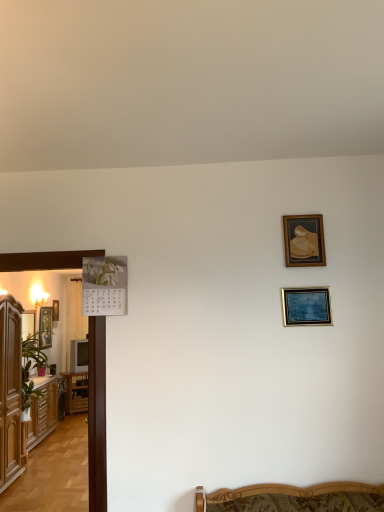
Identify the location of gold-framed picture at left, marked as the fifth picture frame in a right-to-left arrangement. This screenshot has width=384, height=512. (55, 310).

Where is `brown wooden table at left`? This screenshot has height=512, width=384. brown wooden table at left is located at coordinates (76, 392).

Where is `wooden cabinet at left, which is the second cabinetry in front-to-back order`? wooden cabinet at left, which is the second cabinetry in front-to-back order is located at coordinates (41, 413).

The height and width of the screenshot is (512, 384). What do you see at coordinates (28, 324) in the screenshot?
I see `matte wooden picture frame at left, which is the 3th picture frame in front-to-back order` at bounding box center [28, 324].

Identify the location of metallic silver picture frame at center right, the 2th picture frame positioned from the right. The height and width of the screenshot is (512, 384). (306, 306).

From the image's perspective, is wooden cabinet at left, which is the second cabinetry in front-to-back order, located beneath gold-framed picture at left, marked as the fifth picture frame in a right-to-left arrangement?

Yes.

From a real-world perspective, count 4th picture frames upward from the wooden cabinet at left, which is the second cabinetry in front-to-back order, and point to it. Please provide its 2D coordinates.

[(55, 310)]

From a real-world perspective, is wooden cabinet at left, which is the second cabinetry in front-to-back order, physically located above or below gold-framed picture at left, marked as the fifth picture frame in a right-to-left arrangement?

wooden cabinet at left, which is the second cabinetry in front-to-back order, is below gold-framed picture at left, marked as the fifth picture frame in a right-to-left arrangement.

Is gold-framed picture at upper right, which is the fourth picture frame in back-to-front order, at the back of gold-framed portrait at left, acting as the third picture frame starting from the left?

No, gold-framed picture at upper right, which is the fourth picture frame in back-to-front order, is not at the back of gold-framed portrait at left, acting as the third picture frame starting from the left.

Is point (40, 324) less distant than point (298, 232)?

No, (40, 324) is further to viewer.

Locate an element on the screen. The height and width of the screenshot is (512, 384). the 2nd picture frame in front of the gold-framed portrait at left, marked as the third picture frame in a right-to-left arrangement is located at coordinates (304, 240).

Can we say gold-framed portrait at left, acting as the third picture frame starting from the left, lies outside gold-framed picture at upper right, which is the fourth picture frame in back-to-front order?

gold-framed portrait at left, acting as the third picture frame starting from the left, is positioned outside gold-framed picture at upper right, which is the fourth picture frame in back-to-front order.

From the image's perspective, which cabinetry is the 2nd one below the gold-framed picture at upper right, the second picture frame when ordered from front to back? Please provide its 2D coordinates.

[(41, 413)]

Considering the relative positions of gold-framed picture at upper right, which is the first picture frame from right to left, and wooden cabinet at left, which is the second cabinetry in front-to-back order, in the image provided, is gold-framed picture at upper right, which is the first picture frame from right to left, to the right of wooden cabinet at left, which is the second cabinetry in front-to-back order, from the viewer's perspective?

Correct, you'll find gold-framed picture at upper right, which is the first picture frame from right to left, to the right of wooden cabinet at left, which is the second cabinetry in front-to-back order.

Is gold-framed picture at upper right, which is the first picture frame from right to left, smaller than wooden cabinet at left, which is the 1th cabinetry in back-to-front order?

Correct, gold-framed picture at upper right, which is the first picture frame from right to left, occupies less space than wooden cabinet at left, which is the 1th cabinetry in back-to-front order.

Looking at their sizes, would you say gold-framed picture at left, placed as the first picture frame when sorted from back to front, is wider or thinner than wooden cabinet at left, which is the second cabinetry in front-to-back order?

Considering their sizes, gold-framed picture at left, placed as the first picture frame when sorted from back to front, looks slimmer than wooden cabinet at left, which is the second cabinetry in front-to-back order.

Between point (57, 317) and point (32, 409), which one is positioned in front?

The point (32, 409) is in front.

From the gold-framed picture at left, arranged as the 5th picture frame when viewed from the front, count 1st cabinetry to the right and point to it. Please provide its 2D coordinates.

[(41, 413)]

What's the angular difference between gold-framed picture at left, marked as the fifth picture frame in a right-to-left arrangement, and wooden cabinet at left, which is the second cabinetry in front-to-back order,'s facing directions?

The angular difference between gold-framed picture at left, marked as the fifth picture frame in a right-to-left arrangement, and wooden cabinet at left, which is the second cabinetry in front-to-back order, is 3.61 degrees.

Is metallic silver picture frame at center right, which is counted as the 5th picture frame, starting from the back, further to the viewer compared to gold-framed picture at left, marked as the fifth picture frame in a right-to-left arrangement?

No.

Is metallic silver picture frame at center right, marked as the 4th picture frame in a left-to-right arrangement, not within gold-framed picture at left, which is the 1th picture frame in left-to-right order?

Yes, metallic silver picture frame at center right, marked as the 4th picture frame in a left-to-right arrangement, is not within gold-framed picture at left, which is the 1th picture frame in left-to-right order.

From a real-world perspective, does metallic silver picture frame at center right, marked as the 4th picture frame in a left-to-right arrangement, stand above gold-framed picture at left, arranged as the 5th picture frame when viewed from the front?

No.

How different are the orientations of metallic silver picture frame at center right, marked as the 4th picture frame in a left-to-right arrangement, and gold-framed picture at left, which is the 1th picture frame in left-to-right order, in degrees?

There is a 95.6-degree angle between the facing directions of metallic silver picture frame at center right, marked as the 4th picture frame in a left-to-right arrangement, and gold-framed picture at left, which is the 1th picture frame in left-to-right order.

Is brown wooden table at left to the left or to the right of metallic silver picture frame at center right, marked as the first picture frame in a front-to-back arrangement, in the image?

brown wooden table at left is positioned on metallic silver picture frame at center right, marked as the first picture frame in a front-to-back arrangement,'s left side.

Who is taller, brown wooden table at left or metallic silver picture frame at center right, the 2th picture frame positioned from the right?

Standing taller between the two is brown wooden table at left.

Considering the sizes of objects gold-framed portrait at left, acting as the third picture frame starting from the left, and matte wooden picture frame at left, the fourth picture frame positioned from the right, in the image provided, who is taller, gold-framed portrait at left, acting as the third picture frame starting from the left, or matte wooden picture frame at left, the fourth picture frame positioned from the right,?

gold-framed portrait at left, acting as the third picture frame starting from the left.

From the image's perspective, between gold-framed portrait at left, marked as the third picture frame in a right-to-left arrangement, and matte wooden picture frame at left, the 2th picture frame in the left-to-right sequence, which one is located above?

matte wooden picture frame at left, the 2th picture frame in the left-to-right sequence, is shown above in the image.

Is the surface of gold-framed portrait at left, marked as the third picture frame in a right-to-left arrangement, in direct contact with matte wooden picture frame at left, which is counted as the third picture frame, starting from the back?

No, gold-framed portrait at left, marked as the third picture frame in a right-to-left arrangement, is not in contact with matte wooden picture frame at left, which is counted as the third picture frame, starting from the back.

Does gold-framed portrait at left, the 2th picture frame positioned from the back, contain matte wooden picture frame at left, which is counted as the third picture frame, starting from the back?

No, matte wooden picture frame at left, which is counted as the third picture frame, starting from the back, is located outside of gold-framed portrait at left, the 2th picture frame positioned from the back.

In order to click on picture frame that is the 3rd one when counting leftward from the wooden cabinet at left, which is the second cabinetry in front-to-back order in this screenshot , I will do `click(55, 310)`.

This screenshot has height=512, width=384. There is a gold-framed picture at upper right, which is the fourth picture frame in back-to-front order. Find the location of `the 4th picture frame below it (from the image's perspective)`. the 4th picture frame below it (from the image's perspective) is located at coordinates (45, 327).

Based on their spatial positions, is gold-framed picture at left, arranged as the 5th picture frame when viewed from the front, or brown wood cabinet at left, which is the 2th cabinetry in back-to-front order, closer to gold-framed portrait at left, acting as the third picture frame starting from the left?

gold-framed picture at left, arranged as the 5th picture frame when viewed from the front, lies closer to gold-framed portrait at left, acting as the third picture frame starting from the left, than the other object.

Which object lies further to the anchor point matte wooden picture frame at left, which is the 3th picture frame in front-to-back order, gold-framed picture at left, marked as the fifth picture frame in a right-to-left arrangement, or brown wood cabinet at left, acting as the 1th cabinetry starting from the front?

brown wood cabinet at left, acting as the 1th cabinetry starting from the front, is further to matte wooden picture frame at left, which is the 3th picture frame in front-to-back order.

Considering their positions, is brown wooden table at left positioned further to gold-framed picture at upper right, which is the fourth picture frame in back-to-front order, than matte wooden picture frame at left, the 2th picture frame in the left-to-right sequence?

Among the two, brown wooden table at left is located further to gold-framed picture at upper right, which is the fourth picture frame in back-to-front order.

Looking at the image, which one is located closer to brown wooden table at left, gold-framed portrait at left, placed as the fourth picture frame when sorted from front to back, or metallic silver picture frame at center right, marked as the 4th picture frame in a left-to-right arrangement?

The object closer to brown wooden table at left is gold-framed portrait at left, placed as the fourth picture frame when sorted from front to back.

When comparing their distances from matte wooden picture frame at left, the fourth picture frame positioned from the right, does gold-framed portrait at left, placed as the fourth picture frame when sorted from front to back, or wooden cabinet at left, which is the second cabinetry in front-to-back order, seem further?

wooden cabinet at left, which is the second cabinetry in front-to-back order, is positioned further to the anchor matte wooden picture frame at left, the fourth picture frame positioned from the right.

Which object lies nearer to the anchor point matte wooden picture frame at left, which is the 3th picture frame in front-to-back order, brown wooden table at left or wooden cabinet at left, which is the 1th cabinetry in back-to-front order?

wooden cabinet at left, which is the 1th cabinetry in back-to-front order, lies closer to matte wooden picture frame at left, which is the 3th picture frame in front-to-back order, than the other object.

From the image, which object appears to be farther from gold-framed portrait at left, acting as the third picture frame starting from the left, wooden cabinet at left, which is the second cabinetry in front-to-back order, or metallic silver picture frame at center right, marked as the first picture frame in a front-to-back arrangement?

metallic silver picture frame at center right, marked as the first picture frame in a front-to-back arrangement, is further to gold-framed portrait at left, acting as the third picture frame starting from the left.

Which object lies further to the anchor point matte wooden picture frame at left, which is counted as the third picture frame, starting from the back, gold-framed portrait at left, the 2th picture frame positioned from the back, or brown wooden table at left?

brown wooden table at left is further to matte wooden picture frame at left, which is counted as the third picture frame, starting from the back.

Where is `table located between gold-framed picture at upper right, the second picture frame when ordered from front to back, and gold-framed picture at left, placed as the first picture frame when sorted from back to front, in the depth direction`? table located between gold-framed picture at upper right, the second picture frame when ordered from front to back, and gold-framed picture at left, placed as the first picture frame when sorted from back to front, in the depth direction is located at coordinates (76, 392).

The height and width of the screenshot is (512, 384). Identify the location of cabinetry located between wooden cabinet at left, which is the 1th cabinetry in back-to-front order, and gold-framed picture at upper right, which is the fourth picture frame in back-to-front order, in the left-right direction. (10, 390).

Locate an element on the screen. This screenshot has height=512, width=384. table positioned between wooden cabinet at left, which is the 1th cabinetry in back-to-front order, and gold-framed picture at left, arranged as the 5th picture frame when viewed from the front, from near to far is located at coordinates (76, 392).

This screenshot has width=384, height=512. Find the location of `cabinetry between wooden cabinet at left, which is the 1th cabinetry in back-to-front order, and metallic silver picture frame at center right, which is counted as the 5th picture frame, starting from the back, in the horizontal direction`. cabinetry between wooden cabinet at left, which is the 1th cabinetry in back-to-front order, and metallic silver picture frame at center right, which is counted as the 5th picture frame, starting from the back, in the horizontal direction is located at coordinates (10, 390).